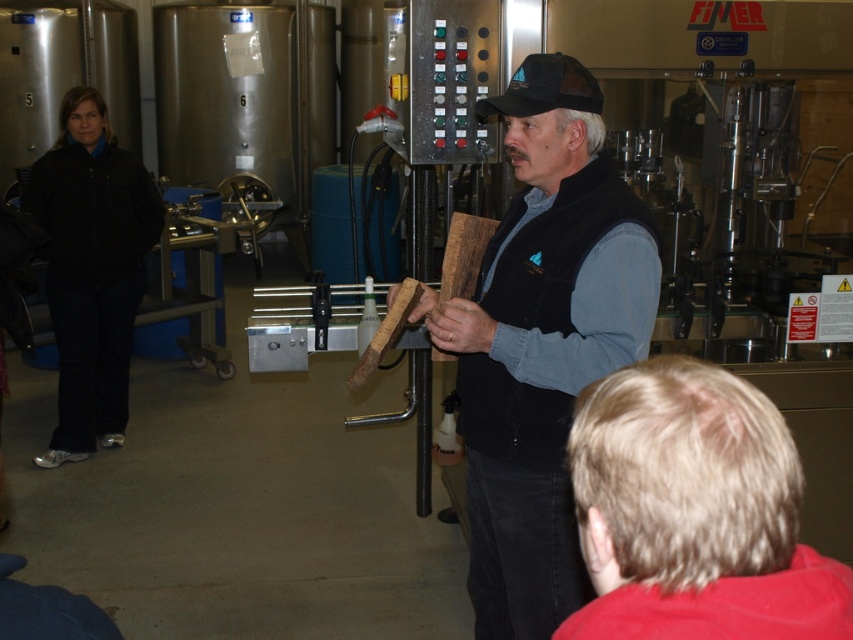
Question: Can you confirm if wooden plank at center is positioned to the right of blonde hair at lower right?

Choices:
 (A) no
 (B) yes

Answer: (A)

Question: Which object is closer to the camera taking this photo?

Choices:
 (A) wooden plank at center
 (B) blonde hair at lower right

Answer: (B)

Question: Which object is closer to the camera taking this photo?

Choices:
 (A) wooden plank at center
 (B) blonde hair at lower right

Answer: (B)

Question: Which object is farther from the camera taking this photo?

Choices:
 (A) wooden plank at center
 (B) blonde hair at lower right

Answer: (A)

Question: Can you confirm if wooden plank at center is positioned to the right of blonde hair at lower right?

Choices:
 (A) yes
 (B) no

Answer: (B)

Question: Can you confirm if wooden plank at center is positioned below blonde hair at lower right?

Choices:
 (A) no
 (B) yes

Answer: (A)